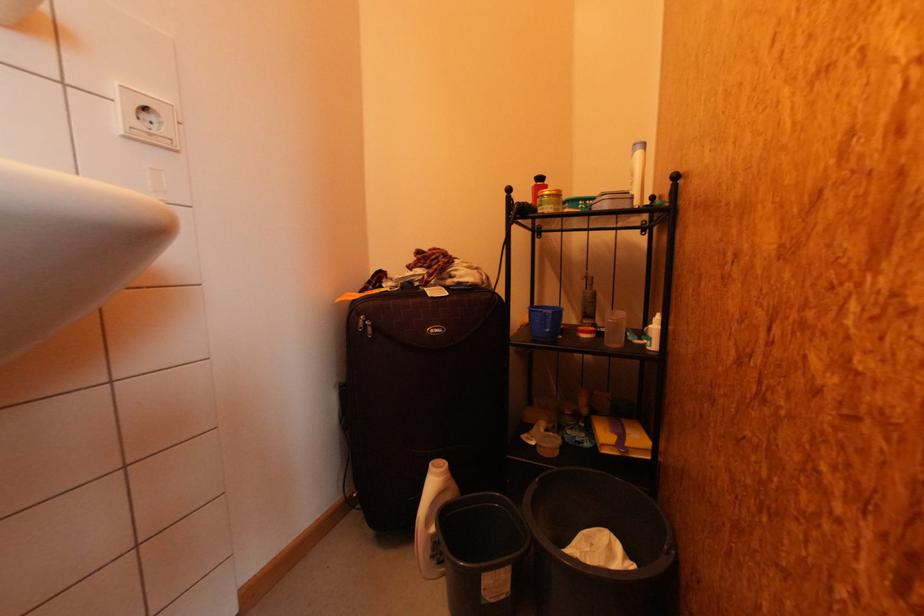
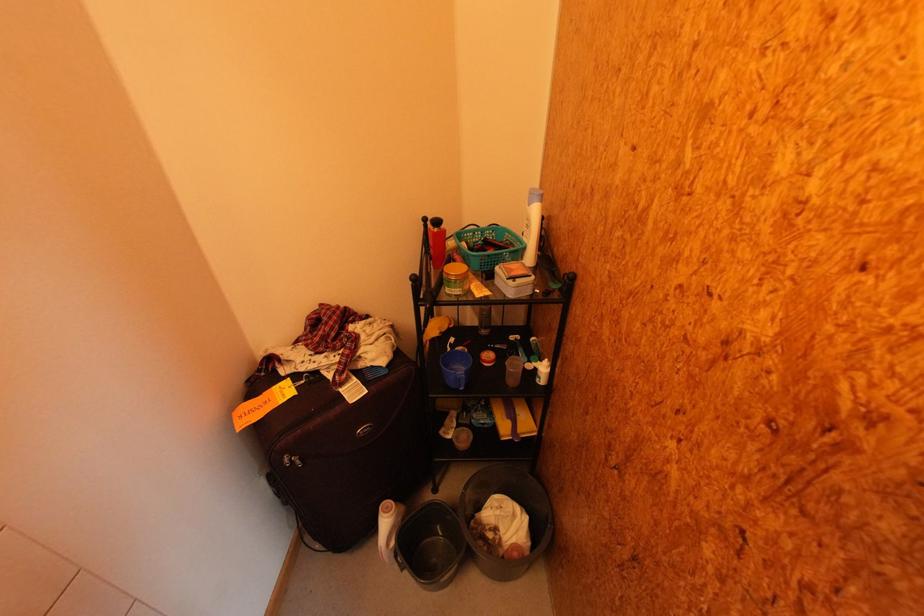
Question: I am providing you with two images of the same scene from different viewpoints. Please identify which objects are invisible in image2.

Choices:
 (A) white plastic bottle
 (B) black bucket
 (C) turquoise basket handle
 (D) none of these

Answer: (D)